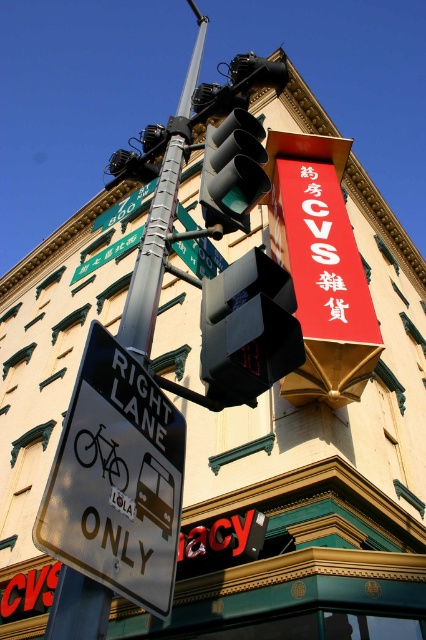
You are standing at the street corner and see two points marked on the traffic signal pole. The first point is at coordinates point (137, 403) and the second is at point (137, 237). Which point is closer to you?

Point (137, 403) is closer to the camera than point (137, 237).

You are standing at the street corner and want to determine which of the two points, point (97, 572) or point (81, 272), is closer to you. Based on the scene, which point is nearer?

Point (97, 572) is closer to the viewer than point (81, 272).

You are standing at the street corner and want to determine which of the two points, point (103, 524) or point (218, 198), is nearer to you. Based on the scene, which point is closer?

Point (103, 524) is closer to the viewer than point (218, 198).